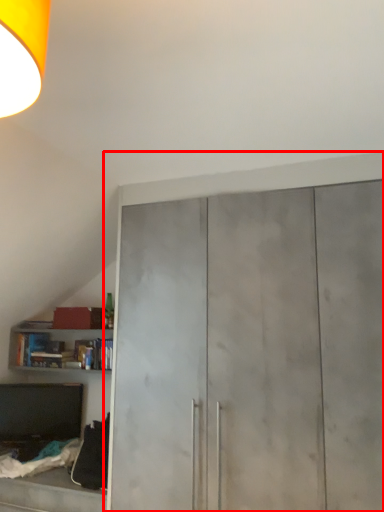
Question: From the image, what is the correct spatial relationship of cupboard (annotated by the red box) in relation to cabinetry?

Choices:
 (A) right
 (B) left

Answer: (A)